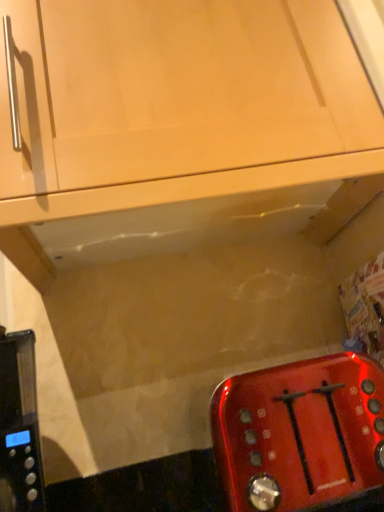
Question: Would you say shiny metallic toaster at lower right is to the left or to the right of matte wood cabinet at upper center in the picture?

Choices:
 (A) right
 (B) left

Answer: (A)

Question: Considering their positions, is shiny metallic toaster at lower right located in front of or behind matte wood cabinet at upper center?

Choices:
 (A) front
 (B) behind

Answer: (A)

Question: Is point (281, 509) positioned closer to the camera than point (122, 46)?

Choices:
 (A) farther
 (B) closer

Answer: (B)

Question: Is matte wood cabinet at upper center bigger or smaller than shiny metallic toaster at lower right?

Choices:
 (A) big
 (B) small

Answer: (A)

Question: Is point pos(322,99) closer or farther from the camera than point pos(294,480)?

Choices:
 (A) farther
 (B) closer

Answer: (B)

Question: Considering their positions, is matte wood cabinet at upper center located in front of or behind shiny metallic toaster at lower right?

Choices:
 (A) behind
 (B) front

Answer: (A)

Question: From the image's perspective, is matte wood cabinet at upper center located above or below shiny metallic toaster at lower right?

Choices:
 (A) below
 (B) above

Answer: (B)